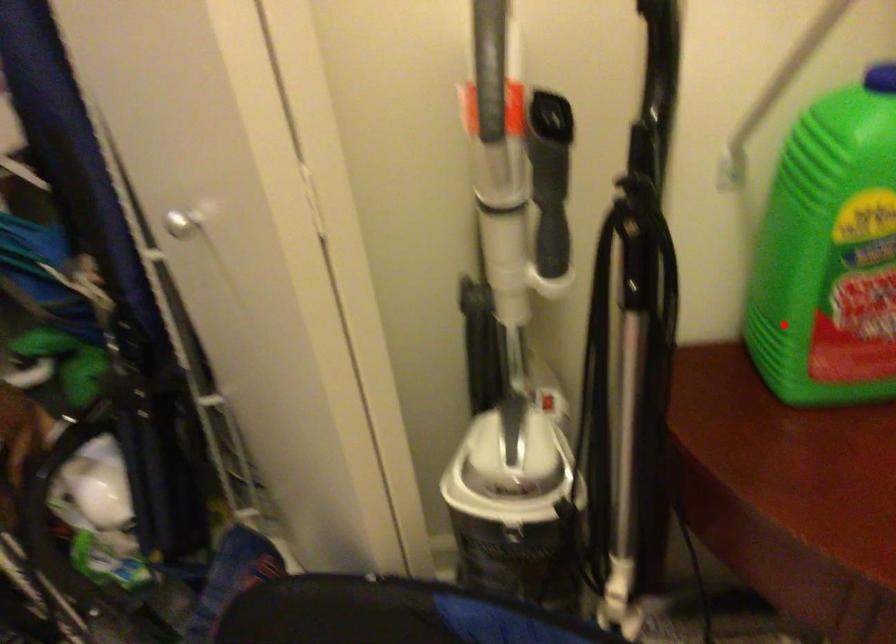
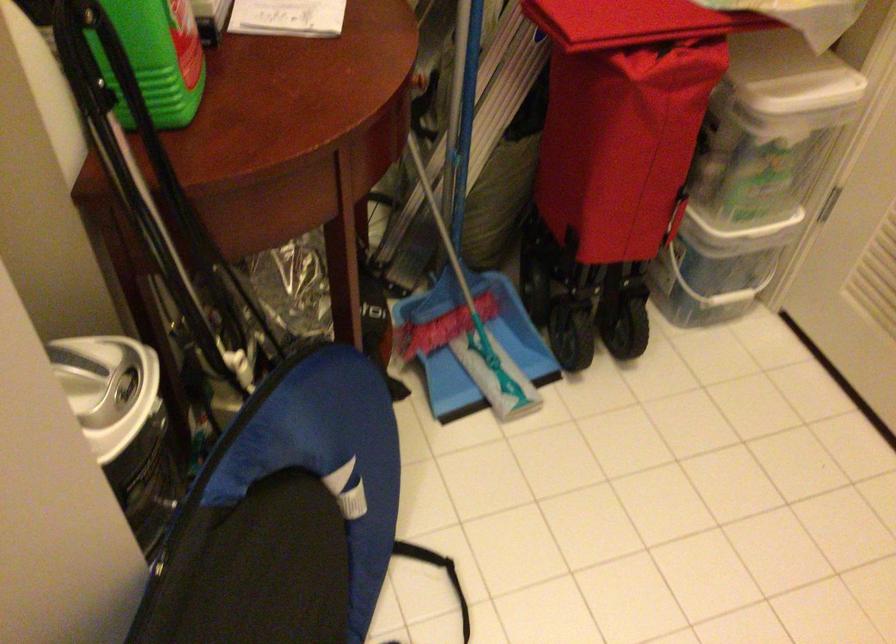
Where in the second image is the point corresponding to the highlighted location from the first image?

(156, 59)